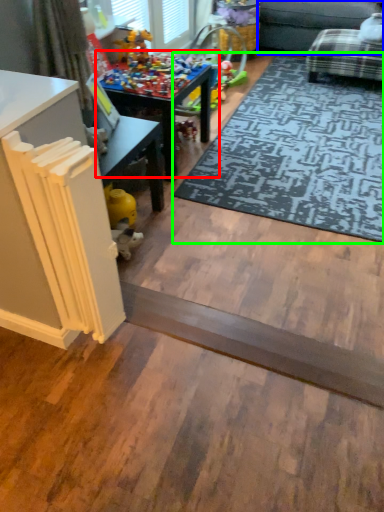
Question: Estimate the real-world distances between objects in this image. Which object is closer to table (highlighted by a red box), couch (highlighted by a blue box) or mat (highlighted by a green box)?

Choices:
 (A) couch
 (B) mat

Answer: (B)